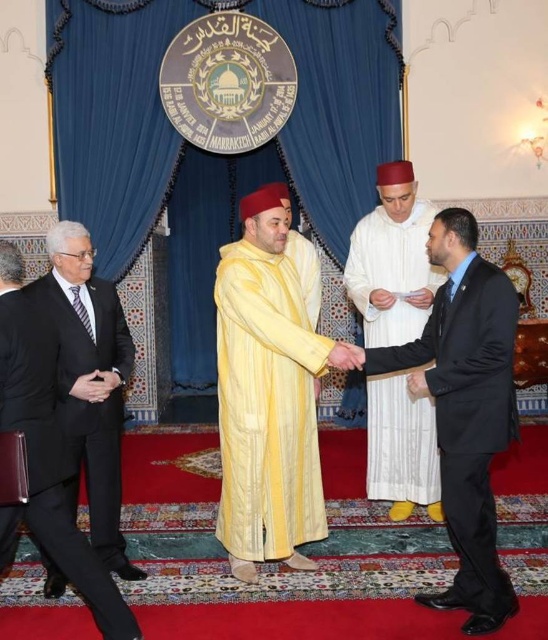
From the picture: Can you confirm if white textured robe at center is shorter than black suit at left?

Yes, white textured robe at center is shorter than black suit at left.

How much distance is there between white textured robe at center and black suit at left?

white textured robe at center and black suit at left are 2.02 meters apart.

Is point (404, 420) positioned behind point (8, 396)?

Yes, it is behind point (8, 396).

This screenshot has width=548, height=640. Identify the location of white textured robe at center. (391, 260).

What do you see at coordinates (465, 408) in the screenshot?
I see `black suit at center` at bounding box center [465, 408].

From the picture: Can you confirm if black suit at center is taller than black wool suit at left?

Correct, black suit at center is much taller as black wool suit at left.

Which is in front, point (475, 568) or point (36, 284)?

Positioned in front is point (475, 568).

Where is `black suit at center`? black suit at center is located at coordinates (465, 408).

Who is shorter, black wool suit at left or black suit at left?

black suit at left

Is black wool suit at left thinner than black suit at left?

In fact, black wool suit at left might be wider than black suit at left.

Describe the element at coordinates (92, 397) in the screenshot. I see `black wool suit at left` at that location.

The height and width of the screenshot is (640, 548). I want to click on black wool suit at left, so click(92, 397).